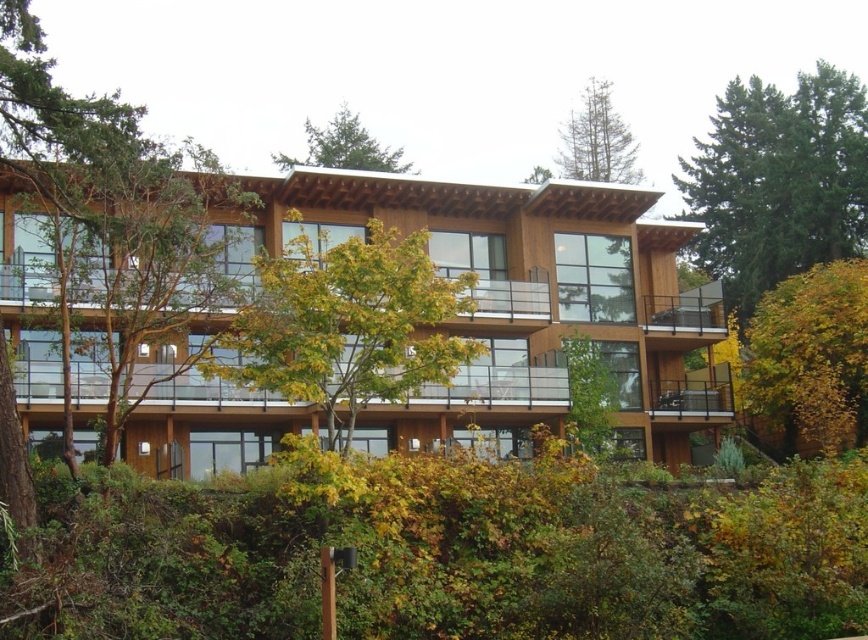
Is green leafy hedge at lower center wider than green needle-like tree at upper center?

Indeed, green leafy hedge at lower center has a greater width compared to green needle-like tree at upper center.

Between point (390, 573) and point (584, 92), which one is positioned in front?

Positioned in front is point (390, 573).

Between point (546, 509) and point (556, 164), which one is positioned behind?

Positioned behind is point (556, 164).

Where is `green leafy hedge at lower center`? The width and height of the screenshot is (868, 640). green leafy hedge at lower center is located at coordinates (446, 556).

Measure the distance between point (610, 90) and camera.

197.05 meters

Is green needle-like tree at upper center shorter than green leafy tree at upper center?

Incorrect, green needle-like tree at upper center's height does not fall short of green leafy tree at upper center's.

Find the location of a particular element. green needle-like tree at upper center is located at coordinates (597, 140).

The height and width of the screenshot is (640, 868). Identify the location of green needle-like tree at upper center. (597, 140).

Consider the image. Does green leafy hedge at lower center appear under yellow leafy tree at lower right?

Indeed, green leafy hedge at lower center is positioned under yellow leafy tree at lower right.

This screenshot has height=640, width=868. Describe the element at coordinates (446, 556) in the screenshot. I see `green leafy hedge at lower center` at that location.

Locate an element on the screen. This screenshot has height=640, width=868. green leafy hedge at lower center is located at coordinates (446, 556).